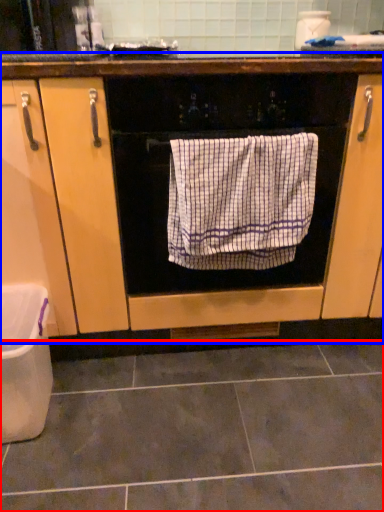
Question: Which of the following is the closest to the observer, ceramic tile (highlighted by a red box) or cabinetry (highlighted by a blue box)?

Choices:
 (A) ceramic tile
 (B) cabinetry

Answer: (A)